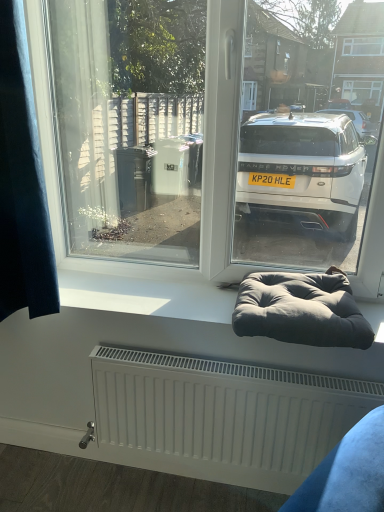
Question: Can you confirm if white matte window sill at center is positioned to the left of dark blue fabric at left?

Choices:
 (A) yes
 (B) no

Answer: (B)

Question: Is dark blue fabric at left located within white matte window sill at center?

Choices:
 (A) yes
 (B) no

Answer: (B)

Question: Can you confirm if white matte window sill at center is wider than dark blue fabric at left?

Choices:
 (A) yes
 (B) no

Answer: (A)

Question: Considering the relative sizes of white matte window sill at center and dark blue fabric at left in the image provided, is white matte window sill at center thinner than dark blue fabric at left?

Choices:
 (A) no
 (B) yes

Answer: (A)

Question: Is white matte window sill at center oriented away from dark blue fabric at left?

Choices:
 (A) yes
 (B) no

Answer: (B)

Question: Looking at their shapes, would you say white matte window sill at center is wider or thinner than dark gray fabric bean bag at lower center?

Choices:
 (A) wide
 (B) thin

Answer: (B)

Question: Would you say white matte window sill at center is inside or outside dark gray fabric bean bag at lower center?

Choices:
 (A) inside
 (B) outside

Answer: (B)

Question: Considering the positions of point (220, 316) and point (336, 283), is point (220, 316) closer or farther from the camera than point (336, 283)?

Choices:
 (A) farther
 (B) closer

Answer: (B)

Question: Is white matte window sill at center in front of or behind dark gray fabric bean bag at lower center in the image?

Choices:
 (A) behind
 (B) front

Answer: (A)

Question: Is point (33, 262) closer or farther from the camera than point (218, 295)?

Choices:
 (A) closer
 (B) farther

Answer: (A)

Question: Looking at the image, does dark blue fabric at left seem bigger or smaller compared to white matte window sill at center?

Choices:
 (A) big
 (B) small

Answer: (A)

Question: Would you say dark blue fabric at left is to the left or to the right of white matte window sill at center in the picture?

Choices:
 (A) right
 (B) left

Answer: (B)

Question: From the image's perspective, relative to white matte window sill at center, is dark blue fabric at left above or below?

Choices:
 (A) above
 (B) below

Answer: (A)

Question: Is dark gray fabric bean bag at lower center bigger or smaller than dark blue fabric at left?

Choices:
 (A) big
 (B) small

Answer: (B)

Question: Is point coord(284,327) closer or farther from the camera than point coord(43,204)?

Choices:
 (A) closer
 (B) farther

Answer: (B)